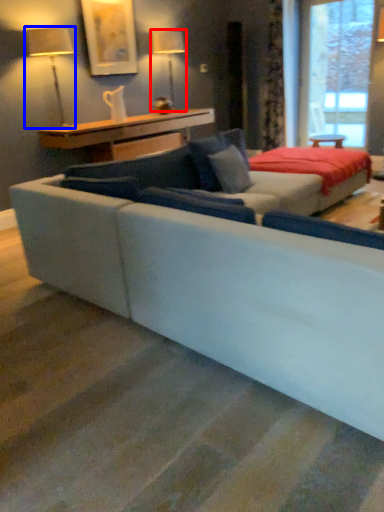
Question: Which point is closer to the camera, table lamp (highlighted by a red box) or table lamp (highlighted by a blue box)?

Choices:
 (A) table lamp
 (B) table lamp

Answer: (B)